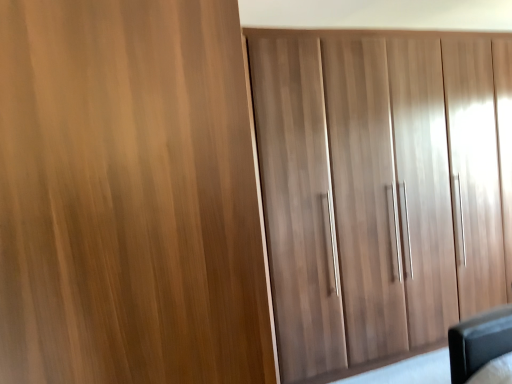
Locate an element on the screen. The width and height of the screenshot is (512, 384). satin wood cupboard at center is located at coordinates (381, 188).

The image size is (512, 384). Describe the element at coordinates (381, 188) in the screenshot. I see `satin wood cupboard at center` at that location.

Image resolution: width=512 pixels, height=384 pixels. Find the location of `satin wood cupboard at center`. satin wood cupboard at center is located at coordinates (381, 188).